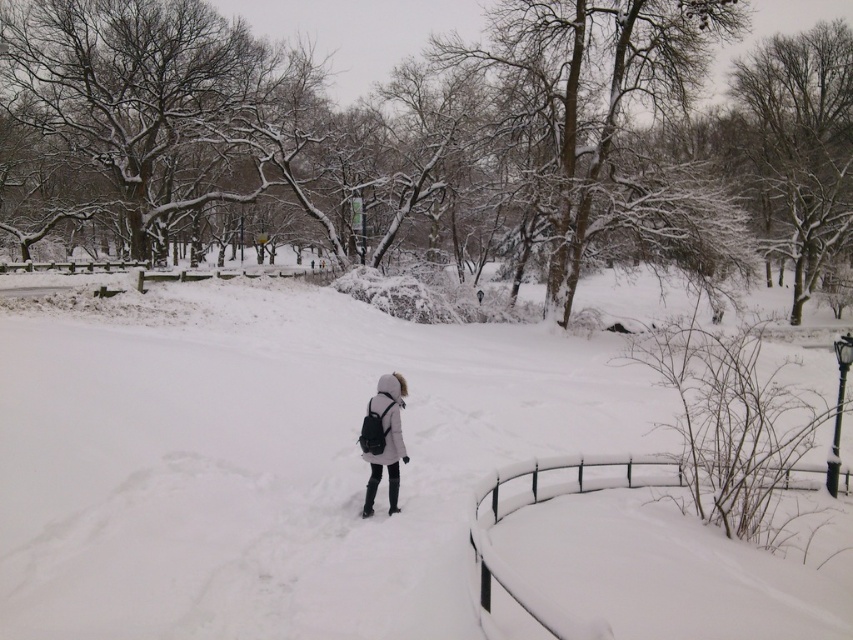
You are a photographer trying to capture the person in the winter scene. Since both the white fluffy snow at center and white matte coat at center are white, which object should you focus on to ensure the subject stands out against the snow?

The white fluffy snow at center is in front of the white matte coat at center, so focusing on the white matte coat at center will help the subject stand out as it is behind the snow.

You are standing at the center of the winter scene. There is a point marked at coordinate (x=270, y=458). What is located at that point?

The point at coordinate (x=270, y=458) indicates white fluffy snow at center.

You are a photographer standing at the edge of the snowy area. You want to take a photo that includes both the white fluffy snow at center and the white matte coat at center. Given that your camera has a maximum focus range of 5 meters, will you be able to capture both objects clearly in the same photo?

The distance between the white fluffy snow at center and the white matte coat at center is 5.87 meters. Since the camera can only focus up to 5 meters, the objects are too far apart to be both in focus simultaneously.